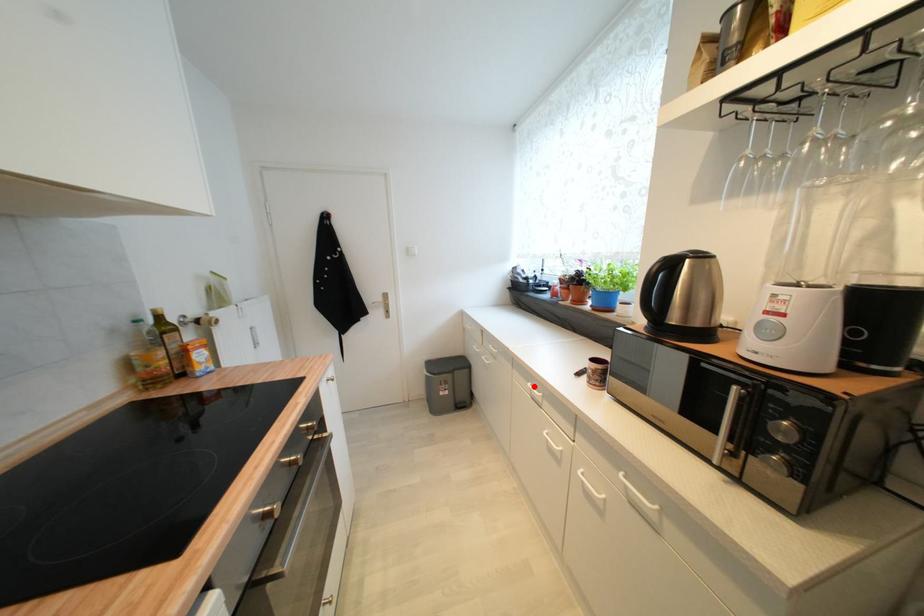
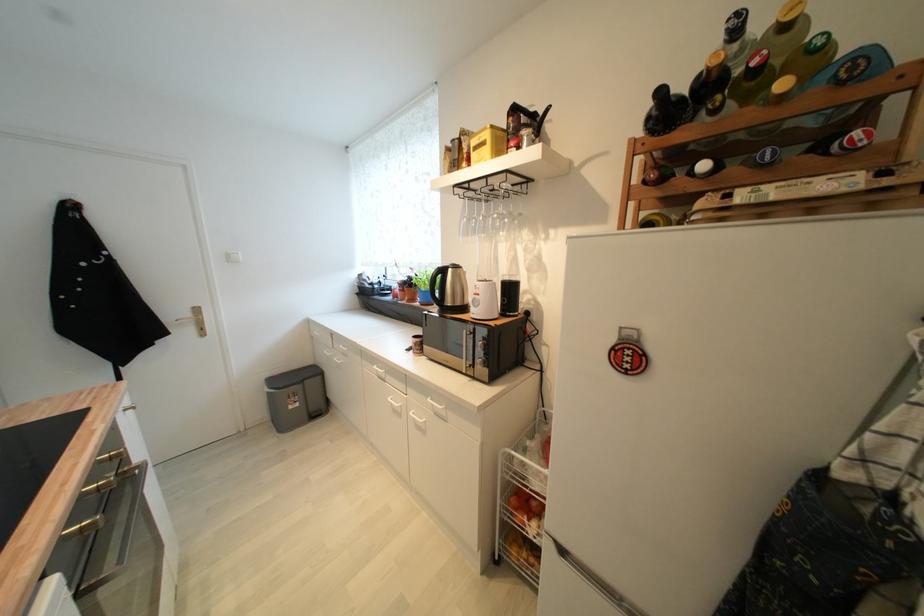
Where in the second image is the point corresponding to the highlighted location from the first image?

(380, 369)